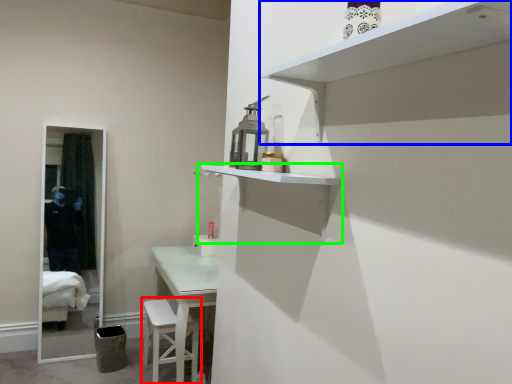
Question: Which object is positioned closest to step stool (highlighted by a red box)? Select from shelf (highlighted by a blue box) and shelf (highlighted by a green box).

Choices:
 (A) shelf
 (B) shelf

Answer: (B)